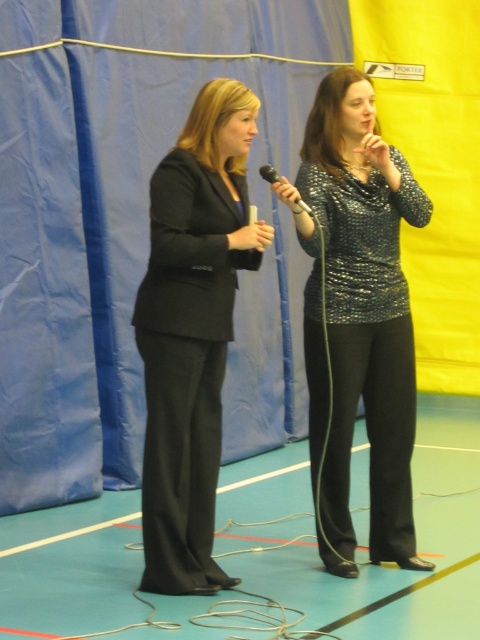
Can you confirm if black matte suit at center is positioned to the right of black metallic microphone at center?

In fact, black matte suit at center is to the left of black metallic microphone at center.

Does black matte suit at center have a greater width compared to black metallic microphone at center?

Yes.

Describe the element at coordinates (186, 364) in the screenshot. The image size is (480, 640). I see `black matte suit at center` at that location.

Where is `black matte suit at center`? The image size is (480, 640). black matte suit at center is located at coordinates (186, 364).

What do you see at coordinates (359, 316) in the screenshot?
I see `sparkly silver blouse at center` at bounding box center [359, 316].

Can you confirm if sparkly silver blouse at center is wider than black metallic microphone at center?

Indeed, sparkly silver blouse at center has a greater width compared to black metallic microphone at center.

Does point (388, 161) come closer to viewer compared to point (299, 202)?

That is False.

Locate an element on the screen. sparkly silver blouse at center is located at coordinates (359, 316).

Is point (382, 480) farther from viewer compared to point (215, 195)?

Yes, point (382, 480) is farther from viewer.

Is point (387, 170) farther from viewer compared to point (156, 454)?

Yes, it is behind point (156, 454).

The image size is (480, 640). Identify the location of sparkly silver blouse at center. (359, 316).